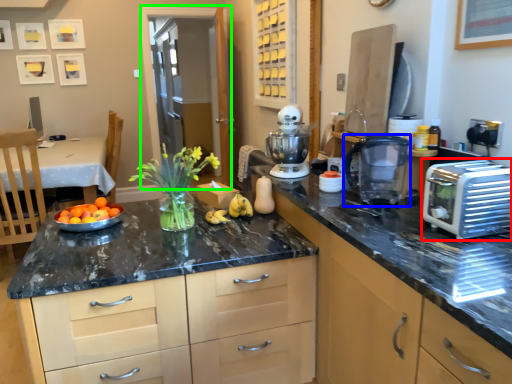
Question: Which is farther away from toaster (highlighted by a red box)? kitchen appliance (highlighted by a blue box) or glass door (highlighted by a green box)?

Choices:
 (A) kitchen appliance
 (B) glass door

Answer: (B)